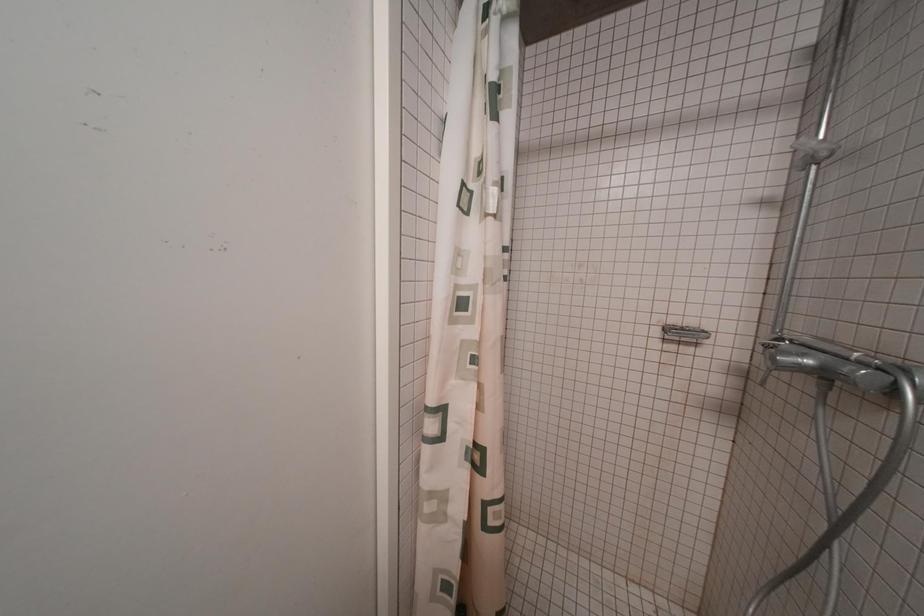
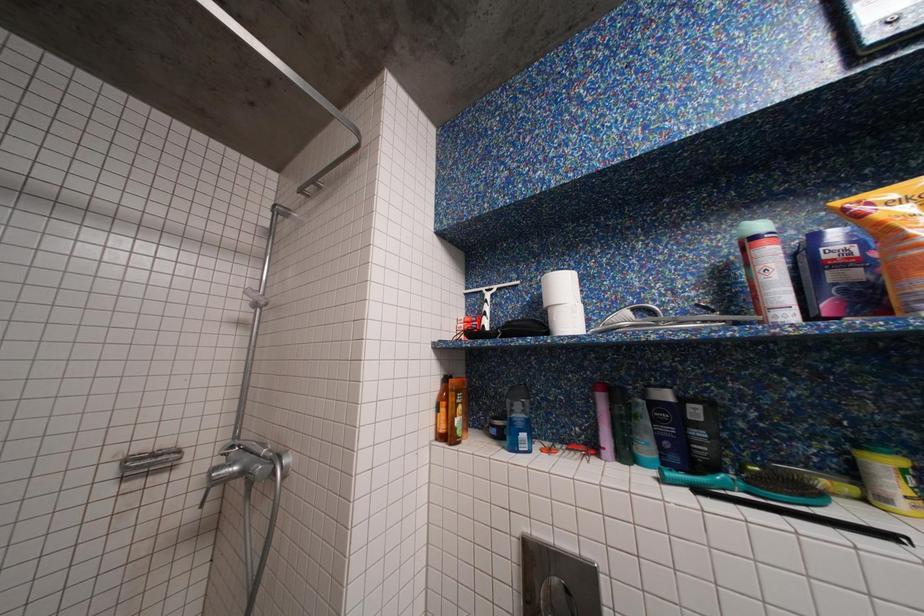
Question: How did the camera likely rotate?

Choices:
 (A) Left
 (B) Right
 (C) Up
 (D) Down

Answer: (B)